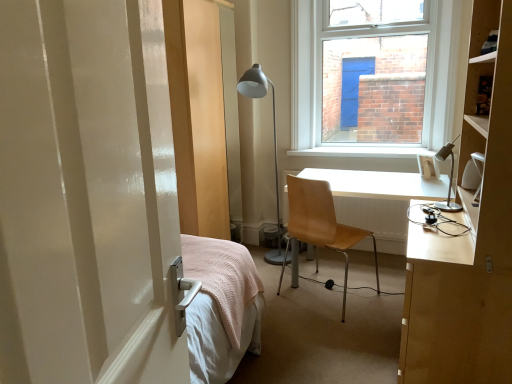
Measure the distance between matte gray floor lamp at center, the 2th lamp positioned from the right, and camera.

The distance of matte gray floor lamp at center, the 2th lamp positioned from the right, from camera is 2.80 meters.

Describe the element at coordinates (449, 178) in the screenshot. Image resolution: width=512 pixels, height=384 pixels. I see `silver metallic desk lamp at right, placed as the second lamp when sorted from back to front` at that location.

What are the coordinates of `white plastic picture frame at upper right` in the screenshot? It's located at (428, 167).

Does matte gray floor lamp at center, the first lamp positioned from the back, have a greater height compared to light brown wood chair at center?

Yes.

Would you say matte gray floor lamp at center, the 2th lamp positioned from the right, is inside or outside light brown wood chair at center?

matte gray floor lamp at center, the 2th lamp positioned from the right, is not enclosed by light brown wood chair at center.

Considering the sizes of objects matte gray floor lamp at center, the 2th lamp positioned from the right, and light brown wood chair at center in the image provided, who is bigger, matte gray floor lamp at center, the 2th lamp positioned from the right, or light brown wood chair at center?

Bigger between the two is matte gray floor lamp at center, the 2th lamp positioned from the right.

From the image's perspective, is light brown wood chair at center located above or below white plastic picture frame at upper right?

Clearly, from the image's perspective, light brown wood chair at center is below white plastic picture frame at upper right.

Considering the positions of points (336, 236) and (428, 179), is point (336, 236) farther from camera compared to point (428, 179)?

That is False.

The height and width of the screenshot is (384, 512). I want to click on picture frame on the right of light brown wood chair at center, so click(x=428, y=167).

Are light brown wood chair at center and white plastic picture frame at upper right beside each other?

No.

Can you see white plastic picture frame at upper right touching silver metallic desk lamp at right, placed as the second lamp when sorted from back to front?

No, white plastic picture frame at upper right is not with silver metallic desk lamp at right, placed as the second lamp when sorted from back to front.

Is white plastic picture frame at upper right situated inside silver metallic desk lamp at right, which is counted as the first lamp, starting from the right, or outside?

white plastic picture frame at upper right is located beyond the bounds of silver metallic desk lamp at right, which is counted as the first lamp, starting from the right.

From a real-world perspective, is white plastic picture frame at upper right physically located above or below silver metallic desk lamp at right, which appears as the first lamp when viewed from the front?

From a real-world perspective, white plastic picture frame at upper right is physically below silver metallic desk lamp at right, which appears as the first lamp when viewed from the front.

How far apart are white plastic picture frame at upper right and silver metallic desk lamp at right, placed as the second lamp when sorted from back to front?

The distance of white plastic picture frame at upper right from silver metallic desk lamp at right, placed as the second lamp when sorted from back to front, is 25.88 inches.

Does white plastic picture frame at upper right have a smaller size compared to light brown wood chair at center?

Yes.

Which object is closer to the camera, white plastic picture frame at upper right or light brown wood chair at center?

light brown wood chair at center.

Could you tell me if white plastic picture frame at upper right is facing light brown wood chair at center?

No, white plastic picture frame at upper right is not aimed at light brown wood chair at center.

Considering the positions of points (426, 160) and (303, 226), is point (426, 160) closer to camera compared to point (303, 226)?

No, (426, 160) is behind (303, 226).

Between silver metallic desk lamp at right, the second lamp in the left-to-right sequence, and white plastic picture frame at upper right, which one has smaller width?

white plastic picture frame at upper right is thinner.

How many degrees apart are the facing directions of silver metallic desk lamp at right, which is counted as the first lamp, starting from the right, and white plastic picture frame at upper right?

They differ by 128 degrees in their facing directions.

Does point (448, 148) appear closer or farther from the camera than point (423, 166)?

Point (448, 148).

Could you tell me if silver metallic desk lamp at right, the second lamp in the left-to-right sequence, is turned towards white plastic picture frame at upper right?

No, silver metallic desk lamp at right, the second lamp in the left-to-right sequence, is not oriented towards white plastic picture frame at upper right.

Is white plastic picture frame at upper right situated inside light brown wood desk at center right or outside?

white plastic picture frame at upper right lies outside light brown wood desk at center right.

Which object is closer to the camera, white plastic picture frame at upper right or light brown wood desk at center right?

Positioned in front is light brown wood desk at center right.

Between white plastic picture frame at upper right and light brown wood desk at center right, which one has smaller size?

With smaller size is white plastic picture frame at upper right.

Does point (433, 175) come farther from viewer compared to point (386, 174)?

No, it is not.

Choose the correct answer: Is light brown wood chair at center inside silver metallic desk lamp at right, which appears as the first lamp when viewed from the front, or outside it?

light brown wood chair at center is located beyond the bounds of silver metallic desk lamp at right, which appears as the first lamp when viewed from the front.

Which of these two, light brown wood chair at center or silver metallic desk lamp at right, the second lamp in the left-to-right sequence, is smaller?

Smaller between the two is silver metallic desk lamp at right, the second lamp in the left-to-right sequence.

Does point (323, 189) lie in front of point (450, 192)?

That is False.

Locate an element on the screen. This screenshot has width=512, height=384. the 1st lamp located above the light brown wood chair at center (from a real-world perspective) is located at coordinates (274, 147).

The height and width of the screenshot is (384, 512). Identify the location of picture frame on the right of light brown wood chair at center. (428, 167).

Considering their positions, is silver metallic desk lamp at right, placed as the second lamp when sorted from back to front, positioned closer to white plastic picture frame at upper right than light brown wood chair at center?

silver metallic desk lamp at right, placed as the second lamp when sorted from back to front.

Considering their positions, is silver metallic desk lamp at right, which is counted as the first lamp, starting from the right, positioned closer to light brown wood desk at center right than matte gray floor lamp at center, the 1th lamp from the left?

Based on the image, silver metallic desk lamp at right, which is counted as the first lamp, starting from the right, appears to be nearer to light brown wood desk at center right.

When comparing their distances from light brown wood chair at center, does silver metallic desk lamp at right, placed as the second lamp when sorted from back to front, or matte gray floor lamp at center, the 1th lamp from the left, seem closer?

silver metallic desk lamp at right, placed as the second lamp when sorted from back to front, is positioned closer to the anchor light brown wood chair at center.

When comparing their distances from white plastic picture frame at upper right, does silver metallic desk lamp at right, placed as the second lamp when sorted from back to front, or light brown wood desk at center right seem closer?

Based on the image, light brown wood desk at center right appears to be nearer to white plastic picture frame at upper right.

From the image, which object appears to be farther from light brown wood chair at center, white plastic picture frame at upper right or matte gray floor lamp at center, the first lamp positioned from the back?

matte gray floor lamp at center, the first lamp positioned from the back, lies further to light brown wood chair at center than the other object.

Looking at this image, from the image, which object appears to be nearer to silver metallic desk lamp at right, the second lamp in the left-to-right sequence, light brown wood desk at center right or light brown wood chair at center?

The object closer to silver metallic desk lamp at right, the second lamp in the left-to-right sequence, is light brown wood desk at center right.

Considering their positions, is light brown wood chair at center positioned further to light brown wood desk at center right than matte gray floor lamp at center, the second lamp positioned from the front?

matte gray floor lamp at center, the second lamp positioned from the front, is positioned further to the anchor light brown wood desk at center right.

From the image, which object appears to be farther from light brown wood desk at center right, light brown wood chair at center or white plastic picture frame at upper right?

light brown wood chair at center is positioned further to the anchor light brown wood desk at center right.

The image size is (512, 384). Identify the location of chair between silver metallic desk lamp at right, which is counted as the first lamp, starting from the right, and white plastic picture frame at upper right in the front-back direction. (320, 224).

You are a GUI agent. You are given a task and a screenshot of the screen. Output one action in this format:
    pyautogui.click(x=<x>, y=<y>)
    Task: Click on the desk between matte gray floor lamp at center, the 2th lamp positioned from the right, and white plastic picture frame at upper right, in the horizontal direction
    
    Given the screenshot: What is the action you would take?
    pyautogui.click(x=378, y=200)

Locate an element on the screen. This screenshot has width=512, height=384. lamp between matte gray floor lamp at center, the 1th lamp from the left, and white plastic picture frame at upper right from left to right is located at coordinates (449, 178).

Find the location of a particular element. chair between matte gray floor lamp at center, the 2th lamp positioned from the right, and silver metallic desk lamp at right, placed as the second lamp when sorted from back to front is located at coordinates (320, 224).